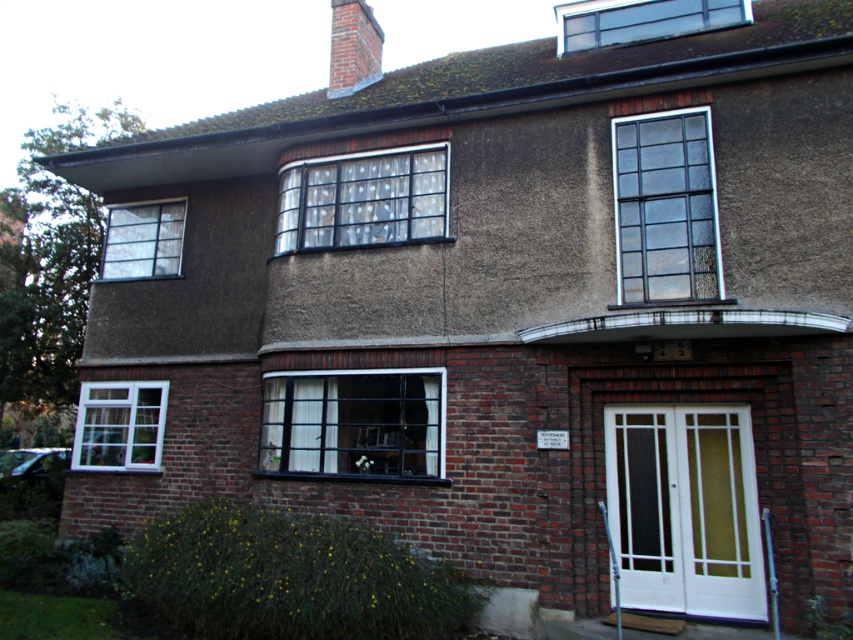
Between clear glass window at upper center and clear glass skylight at upper center, which one appears on the right side from the viewer's perspective?

clear glass skylight at upper center is more to the right.

In the scene shown: Who is more distant from viewer, (706, 216) or (633, 29)?

Point (633, 29)

Is point (677, 170) farther from viewer compared to point (596, 28)?

No, (677, 170) is closer to viewer.

The image size is (853, 640). I want to click on clear glass window at upper center, so click(665, 209).

Measure the distance between clear glass window at center and white plastic window at lower left.

A distance of 12.01 feet exists between clear glass window at center and white plastic window at lower left.

Between clear glass window at center and white plastic window at lower left, which one appears on the right side from the viewer's perspective?

clear glass window at center is more to the right.

Which is behind, point (379, 216) or point (157, 449)?

Positioned behind is point (157, 449).

At what (x,y) coordinates should I click in order to perform the action: click on clear glass window at center. Please return your answer as a coordinate pair (x, y). The image size is (853, 640). Looking at the image, I should click on (363, 198).

Is point (280, 444) farther from viewer compared to point (376, 198)?

No, it is not.

Does point (306, 461) come closer to viewer compared to point (381, 182)?

Yes, it is.

Is point (267, 397) behind point (357, 189)?

No.

This screenshot has width=853, height=640. I want to click on white glass window at center, so click(352, 422).